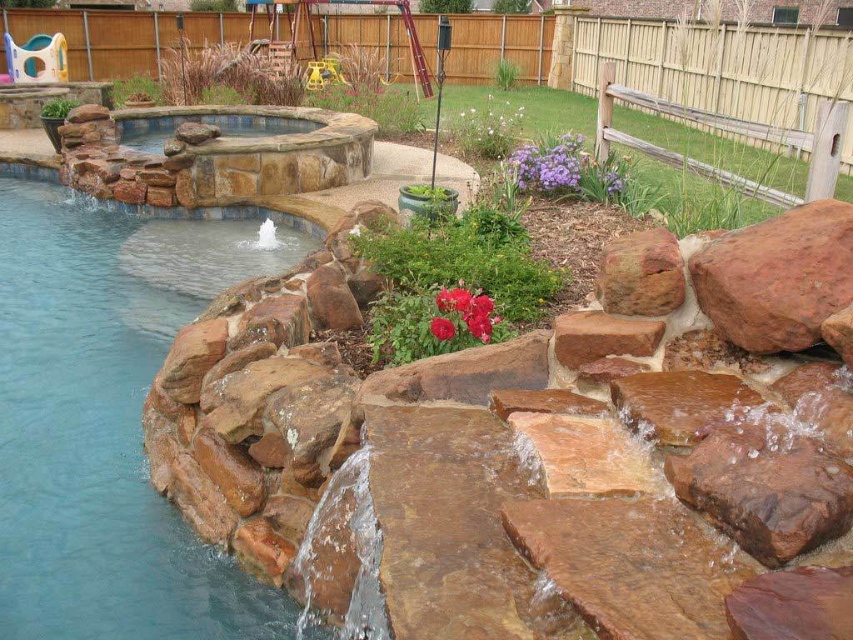
You are designing a garden layout and need to place a decorative statue that requires a base area of 2 square meters. Given the brown stone pond at left and the red matte flower at center, which object can accommodate the statue based on their sizes?

The brown stone pond at left has a larger size compared to the red matte flower at center, so it can accommodate the statue requiring a base area of 2 square meters.

You are standing in the backyard and want to place a small statue between the brown stone pond at left and the rustic brown rock at right. Based on their positions, which object should the statue be closer to?

The statue should be placed closer to the brown stone pond at left since it is positioned to the left of the rustic brown rock at right.